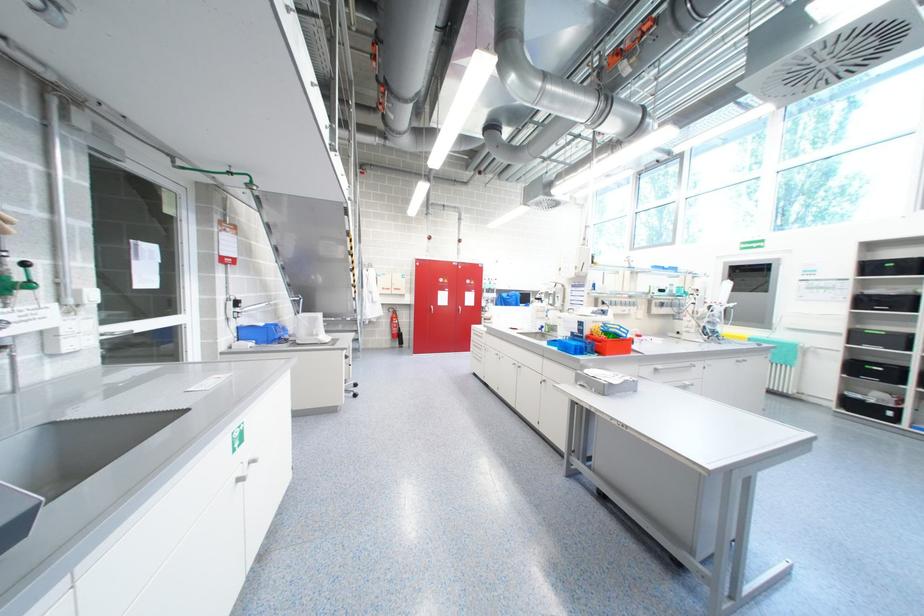
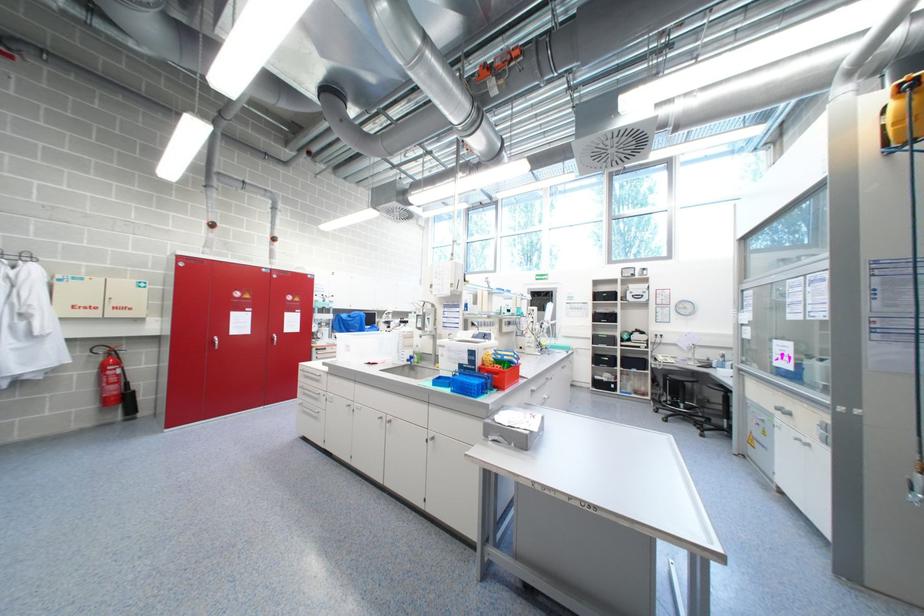
Question: The images are taken continuously from a first-person perspective. In which direction is your viewpoint rotating?

Choices:
 (A) Left
 (B) Right
 (C) Up
 (D) Down

Answer: (B)